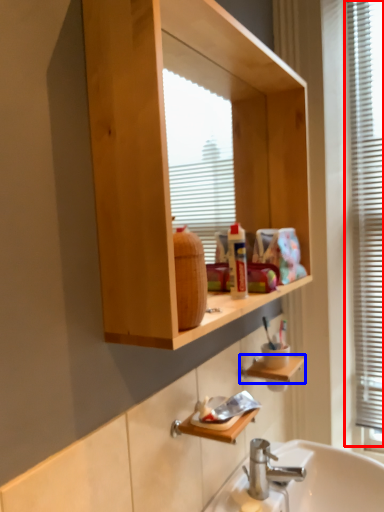
Question: Which object is further to the camera taking this photo, window frame (highlighted by a red box) or cabinet (highlighted by a blue box)?

Choices:
 (A) window frame
 (B) cabinet

Answer: (A)